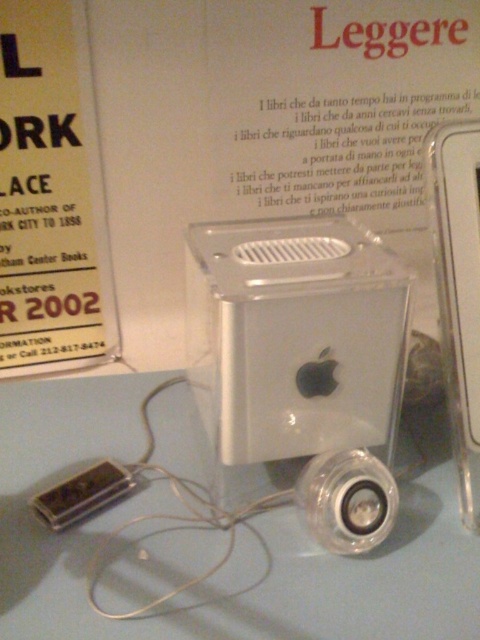
Question: Is white plastic table at center closer to the viewer compared to satin silver computer at center?

Choices:
 (A) no
 (B) yes

Answer: (B)

Question: Which of the following is the closest to the observer?

Choices:
 (A) (140, 584)
 (B) (192, 342)

Answer: (A)

Question: Is white plastic table at center thinner than satin silver computer at center?

Choices:
 (A) yes
 (B) no

Answer: (B)

Question: Which point is farther from the camera taking this photo?

Choices:
 (A) (127, 552)
 (B) (367, 428)

Answer: (B)

Question: Is white plastic table at center smaller than satin silver computer at center?

Choices:
 (A) yes
 (B) no

Answer: (B)